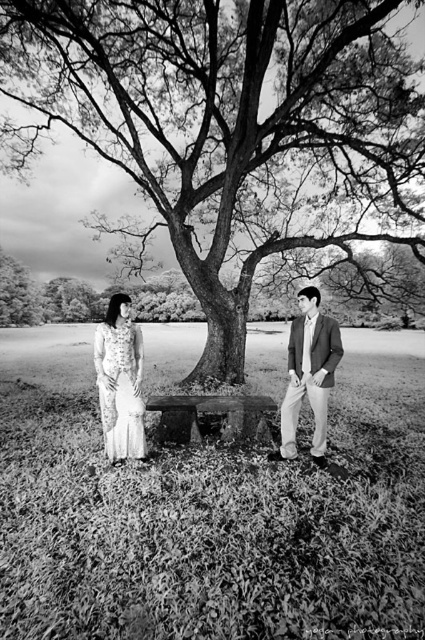
Question: Does dark brown textured tree at center appear over smooth beige suit at center?

Choices:
 (A) yes
 (B) no

Answer: (A)

Question: Can you confirm if dark brown textured tree at center is positioned to the right of matte wood bench at center?

Choices:
 (A) no
 (B) yes

Answer: (B)

Question: Among these objects, which one is nearest to the camera?

Choices:
 (A) matte wood bench at center
 (B) dark brown textured tree at center
 (C) white lace dress at left

Answer: (C)

Question: Which of these objects is positioned closest to the wooden park bench at center?

Choices:
 (A) dark brown textured tree at center
 (B) white lace dress at left
 (C) smooth beige suit at center
 (D) matte wood bench at center

Answer: (C)

Question: Which point is farther to the camera?

Choices:
 (A) matte wood bench at center
 (B) dark brown textured tree at center

Answer: (B)

Question: Is matte wood bench at center positioned behind white lace dress at left?

Choices:
 (A) yes
 (B) no

Answer: (A)